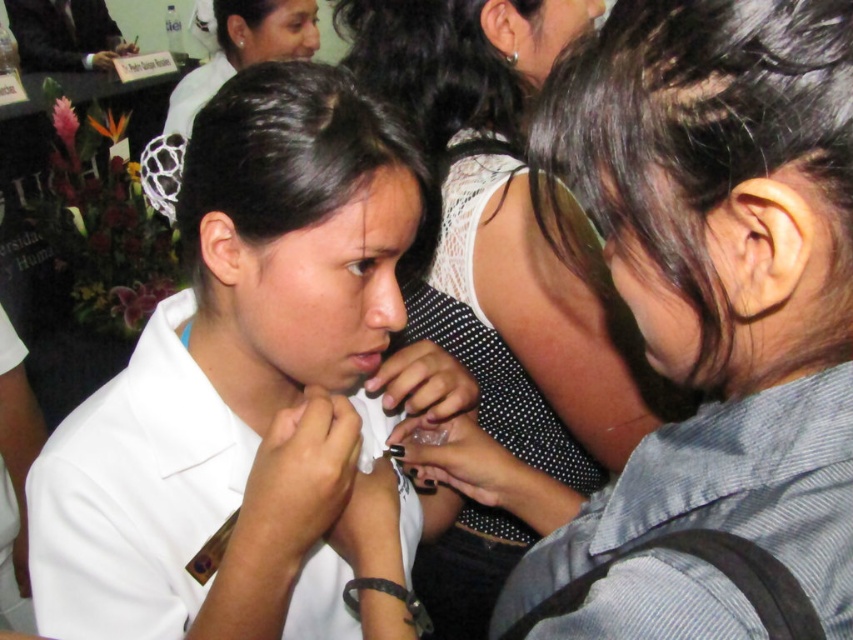
Is point (79, 536) closer to viewer compared to point (293, 17)?

Yes, point (79, 536) is in front of point (293, 17).

Which is more to the left, white uniform shirt at center or white uniform at upper center?

Positioned to the left is white uniform at upper center.

Where is `white uniform shirt at center`? white uniform shirt at center is located at coordinates (247, 381).

Can you confirm if white dotted dress at center is smaller than white uniform at upper center?

No, white dotted dress at center is not smaller than white uniform at upper center.

Who is positioned more to the left, white dotted dress at center or white uniform at upper center?

From the viewer's perspective, white uniform at upper center appears more on the left side.

Is point (492, 488) farther from viewer compared to point (305, 4)?

No, (492, 488) is in front of (305, 4).

This screenshot has height=640, width=853. Identify the location of white dotted dress at center. (529, 243).

Can you confirm if white uniform shirt at center is thinner than white dotted dress at center?

In fact, white uniform shirt at center might be wider than white dotted dress at center.

Measure the distance from white uniform shirt at center to white dotted dress at center.

A distance of 9.54 inches exists between white uniform shirt at center and white dotted dress at center.

What are the coordinates of `white uniform shirt at center` in the screenshot? It's located at (247, 381).